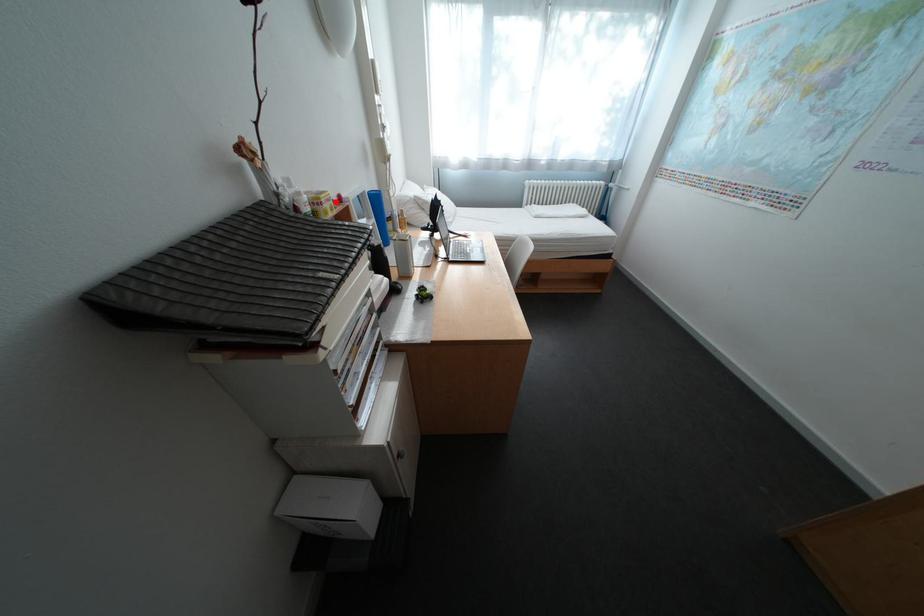
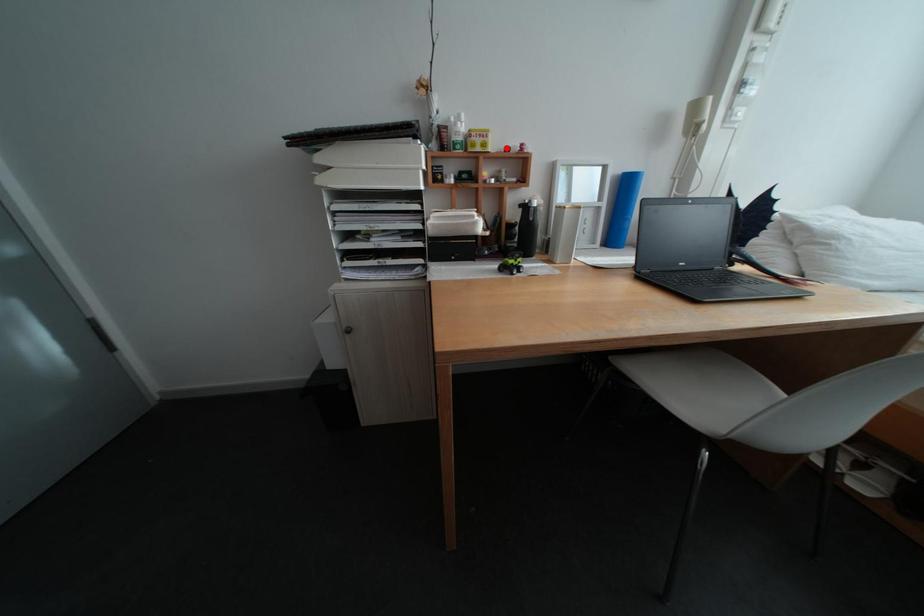
I am providing you with two images of the same scene from different viewpoints. A red point is marked on the first image and another point is marked on the second image. Is the red point in image1 aligned with the point shown in image2?

No